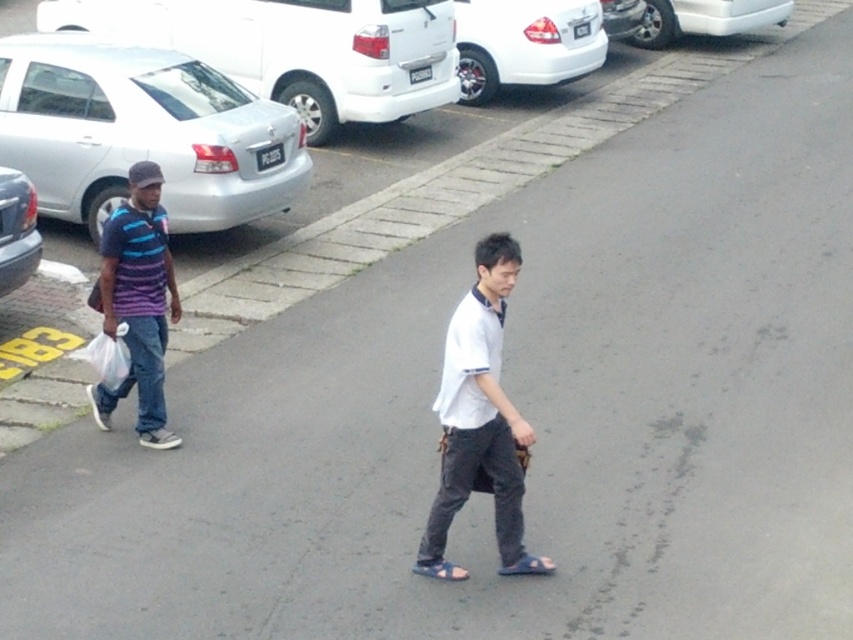
Question: Which point appears farthest from the camera in this image?

Choices:
 (A) (32, 266)
 (B) (402, 29)
 (C) (467, 573)

Answer: (B)

Question: Can you confirm if white matte car at upper right is positioned below white plastic bag at left?

Choices:
 (A) yes
 (B) no

Answer: (B)

Question: Can you confirm if silver metallic sedan at left is thinner than blue rubber sandal at lower center?

Choices:
 (A) yes
 (B) no

Answer: (B)

Question: Which point is closer to the camera?

Choices:
 (A) (7, 275)
 (B) (717, 28)

Answer: (A)

Question: In this image, where is silver metallic sedan at upper left located relative to white matte car at upper right?

Choices:
 (A) above
 (B) below

Answer: (B)

Question: Which point is farther to the camera?

Choices:
 (A) blue rubber sandal at lower center
 (B) white glossy sedan at upper center
 (C) white plastic bag at left
 (D) striped fabric shirt at left

Answer: (B)